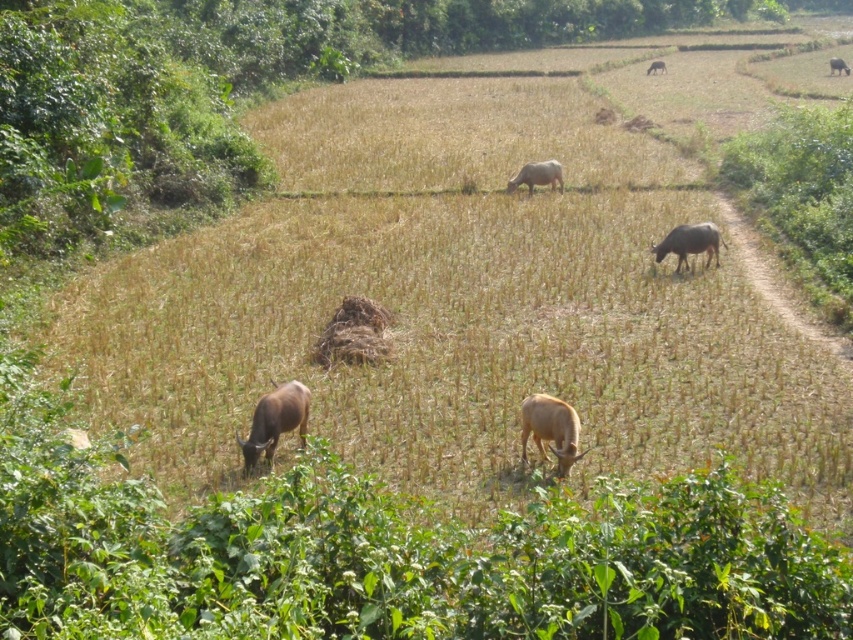
Looking at this image, between brown matte cow at lower left and brown matte cow at center-right, which one appears on the right side from the viewer's perspective?

brown matte cow at center-right is more to the right.

Is brown matte cow at lower left taller than brown matte cow at center-right?

Correct, brown matte cow at lower left is much taller as brown matte cow at center-right.

You are a GUI agent. You are given a task and a screenshot of the screen. Output one action in this format:
    pyautogui.click(x=<x>, y=<y>)
    Task: Click on the brown matte cow at lower left
    The height and width of the screenshot is (640, 853).
    Given the screenshot: What is the action you would take?
    pyautogui.click(x=276, y=420)

Which is more to the left, brown matte cow at center-right or white matte cow at center?

From the viewer's perspective, white matte cow at center appears more on the left side.

Is brown matte cow at center-right positioned in front of white matte cow at center?

Yes, brown matte cow at center-right is in front of white matte cow at center.

The height and width of the screenshot is (640, 853). In order to click on brown matte cow at center-right in this screenshot , I will do click(x=689, y=243).

Locate an element on the screen. This screenshot has width=853, height=640. brown matte cow at center-right is located at coordinates (689, 243).

Is white matte cow at center thinner than brown matte cow at upper center?

In fact, white matte cow at center might be wider than brown matte cow at upper center.

Who is higher up, white matte cow at center or brown matte cow at upper center?

Positioned higher is brown matte cow at upper center.

The image size is (853, 640). Describe the element at coordinates (537, 176) in the screenshot. I see `white matte cow at center` at that location.

Identify the location of white matte cow at center. pyautogui.click(x=537, y=176).